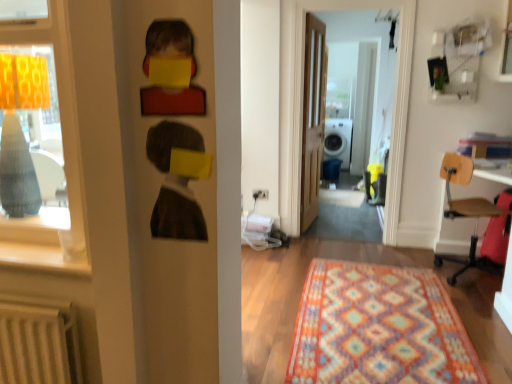
Question: Should I look upward or downward to see charcoal textured portrait at center?

Choices:
 (A) down
 (B) up

Answer: (B)

Question: Can you confirm if transparent glass door at center is taller than wooden door at center?

Choices:
 (A) yes
 (B) no

Answer: (A)

Question: Is wooden door at center a part of transparent glass door at center?

Choices:
 (A) no
 (B) yes

Answer: (A)

Question: Is transparent glass door at center not near wooden door at center?

Choices:
 (A) no
 (B) yes

Answer: (A)

Question: Can we say transparent glass door at center lies outside wooden door at center?

Choices:
 (A) yes
 (B) no

Answer: (A)

Question: Is transparent glass door at center beside wooden door at center?

Choices:
 (A) no
 (B) yes

Answer: (A)

Question: Does transparent glass door at center appear on the left side of wooden door at center?

Choices:
 (A) no
 (B) yes

Answer: (A)

Question: Is wooden door at center next to charcoal textured portrait at center and touching it?

Choices:
 (A) no
 (B) yes

Answer: (A)

Question: Is wooden door at center facing away from charcoal textured portrait at center?

Choices:
 (A) yes
 (B) no

Answer: (B)

Question: Is wooden door at center shorter than charcoal textured portrait at center?

Choices:
 (A) no
 (B) yes

Answer: (A)

Question: From the image's perspective, is wooden door at center beneath charcoal textured portrait at center?

Choices:
 (A) yes
 (B) no

Answer: (B)

Question: Are wooden door at center and charcoal textured portrait at center located far from each other?

Choices:
 (A) no
 (B) yes

Answer: (B)

Question: Is wooden door at center thinner than charcoal textured portrait at center?

Choices:
 (A) yes
 (B) no

Answer: (B)

Question: Considering the relative sizes of wooden seat chair at right and matte wood window sill at left in the image provided, is wooden seat chair at right wider than matte wood window sill at left?

Choices:
 (A) no
 (B) yes

Answer: (B)